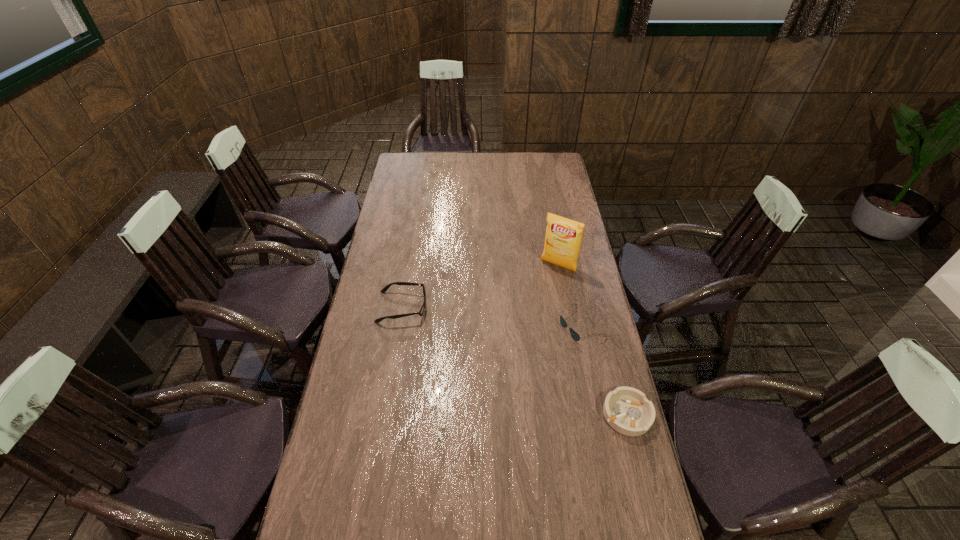
This screenshot has height=540, width=960. Find the location of `vacant space at the near left corner of the desktop`. vacant space at the near left corner of the desktop is located at coordinates (316, 522).

In the image, there is a desktop. Where is `free space at the near right corner`? The height and width of the screenshot is (540, 960). free space at the near right corner is located at coordinates (609, 514).

This screenshot has width=960, height=540. Find the location of `free spot between the sunglasses and the ashtray`. free spot between the sunglasses and the ashtray is located at coordinates (604, 369).

Identify the location of free space between the spectacles and the sunglasses. (492, 316).

This screenshot has width=960, height=540. What are the coordinates of `free space between the sunglasses and the spectacles` in the screenshot? It's located at (492, 316).

Locate an element on the screen. unoccupied position between the nearest object and the sunglasses is located at coordinates (604, 369).

Find the location of a particular element. The width and height of the screenshot is (960, 540). vacant point located between the tallest object and the spectacles is located at coordinates (480, 286).

Where is `vacant region between the sunglasses and the farthest object`? vacant region between the sunglasses and the farthest object is located at coordinates (569, 295).

Where is `free space between the tallest object and the sunglasses`? The height and width of the screenshot is (540, 960). free space between the tallest object and the sunglasses is located at coordinates (569, 295).

In order to click on free space that is in between the ashtray and the sunglasses in this screenshot , I will do `click(604, 369)`.